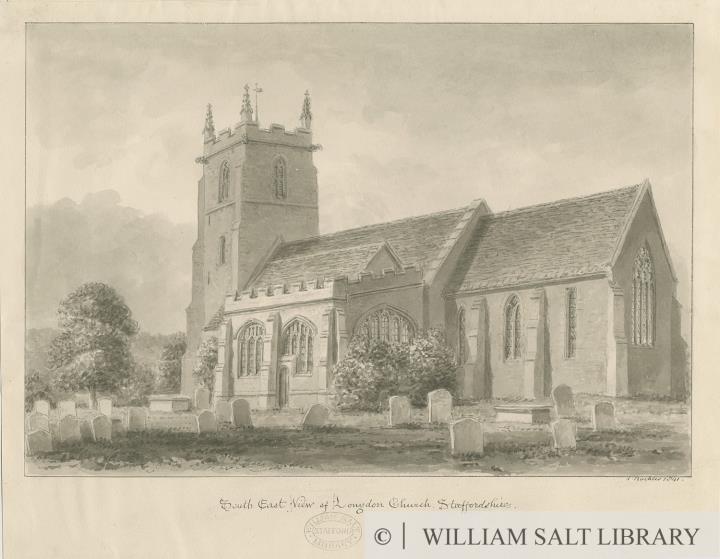
I want to click on narrow windows, so 513,331, 571,334.